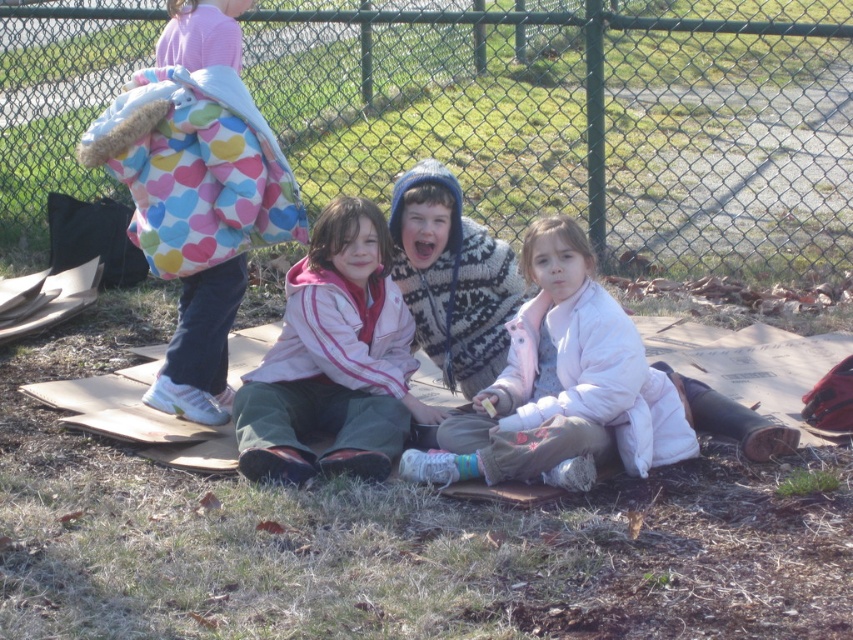
Question: Which point is farther to the camera?

Choices:
 (A) (299, 61)
 (B) (341, 237)

Answer: (A)

Question: Which point is farther to the camera?

Choices:
 (A) metal chain-link fence at upper center
 (B) pink fleece jacket at center

Answer: (A)

Question: Is metal chain-link fence at upper center positioned before pink fleece jacket at center?

Choices:
 (A) no
 (B) yes

Answer: (A)

Question: Considering the relative positions of metal chain-link fence at upper center and pink fleece jacket at center in the image provided, where is metal chain-link fence at upper center located with respect to pink fleece jacket at center?

Choices:
 (A) right
 (B) left

Answer: (A)

Question: Does metal chain-link fence at upper center appear over pink fleece jacket at center?

Choices:
 (A) yes
 (B) no

Answer: (A)